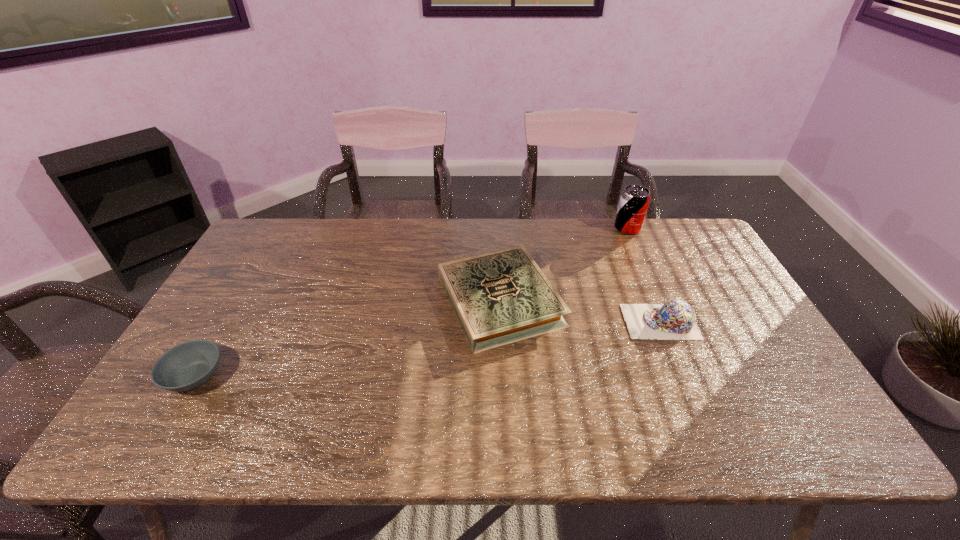
At what (x,y) coordinates should I click in order to perform the action: click on free location located on the back of the soup bowl. Please return your answer as a coordinate pair (x, y). This screenshot has height=540, width=960. Looking at the image, I should click on (259, 267).

Locate an element on the screen. soda can located at the far edge is located at coordinates (634, 201).

Find the location of a particular element. hardback book situated at the far edge is located at coordinates (501, 297).

Find the location of a particular element. Image resolution: width=960 pixels, height=540 pixels. object present at the left edge is located at coordinates (189, 365).

Find the location of a particular element. The height and width of the screenshot is (540, 960). vacant area at the far edge of the desktop is located at coordinates (372, 260).

At what (x,y) coordinates should I click in order to perform the action: click on vacant space at the near edge of the desktop. Please return your answer as a coordinate pair (x, y). Image resolution: width=960 pixels, height=540 pixels. Looking at the image, I should click on (641, 435).

Find the location of a particular element. Image resolution: width=960 pixels, height=540 pixels. vacant space at the left edge of the desktop is located at coordinates (230, 321).

Identify the location of vacant space at the right edge. (686, 271).

In the image, there is a desktop. Identify the location of vacant space at the near right corner. (798, 413).

Image resolution: width=960 pixels, height=540 pixels. What are the coordinates of `free area in between the second object from left to right and the cap` in the screenshot? It's located at (580, 312).